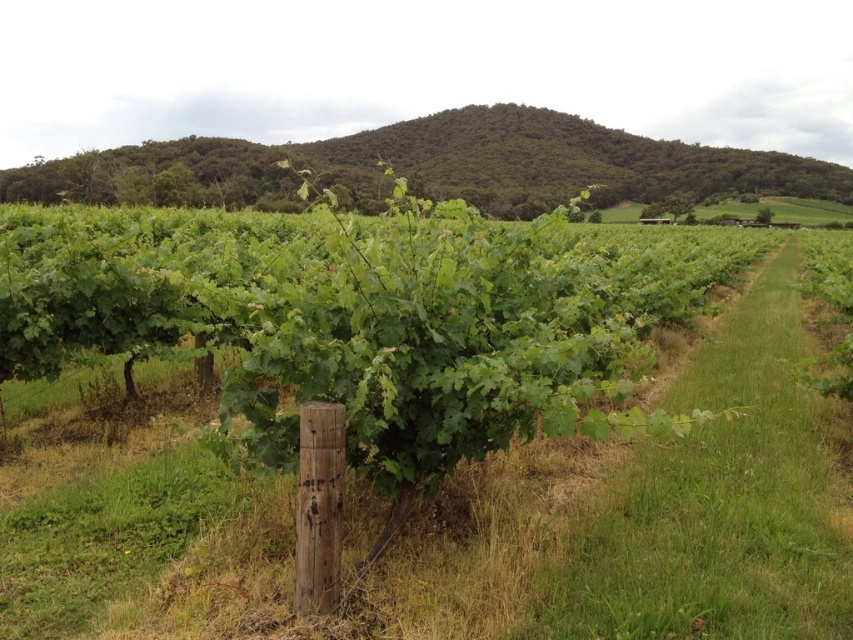
Question: Among these points, which one is nearest to the camera?

Choices:
 (A) (447, 584)
 (B) (471, 154)

Answer: (A)

Question: In this image, where is green leafy vines at center located relative to green leafy hillside at upper center?

Choices:
 (A) left
 (B) right

Answer: (A)

Question: Does green leafy vines at center come behind green leafy hillside at upper center?

Choices:
 (A) yes
 (B) no

Answer: (B)

Question: Can you confirm if green leafy vines at center is wider than green leafy hillside at upper center?

Choices:
 (A) yes
 (B) no

Answer: (B)

Question: Which of the following is the farthest from the observer?

Choices:
 (A) green leafy vines at center
 (B) green leafy hillside at upper center

Answer: (B)